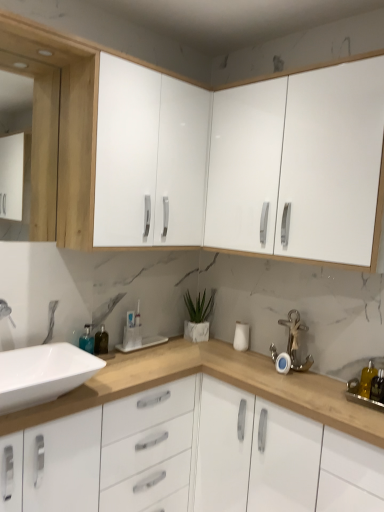
Question: Does white glossy sink at lower left have a smaller size compared to silver metallic anchor at lower right?

Choices:
 (A) yes
 (B) no

Answer: (B)

Question: Does white glossy sink at lower left appear on the right side of silver metallic anchor at lower right?

Choices:
 (A) no
 (B) yes

Answer: (A)

Question: Is white glossy sink at lower left behind silver metallic anchor at lower right?

Choices:
 (A) no
 (B) yes

Answer: (A)

Question: Is white glossy sink at lower left aimed at silver metallic anchor at lower right?

Choices:
 (A) no
 (B) yes

Answer: (A)

Question: From a real-world perspective, is white glossy sink at lower left physically above silver metallic anchor at lower right?

Choices:
 (A) no
 (B) yes

Answer: (A)

Question: Is translucent plastic bottle at lower right in front of or behind matte wood medicine cabinet at left in the image?

Choices:
 (A) behind
 (B) front

Answer: (A)

Question: Do you think translucent plastic bottle at lower right is within matte wood medicine cabinet at left, or outside of it?

Choices:
 (A) outside
 (B) inside

Answer: (A)

Question: From their relative heights in the image, would you say translucent plastic bottle at lower right is taller or shorter than matte wood medicine cabinet at left?

Choices:
 (A) tall
 (B) short

Answer: (B)

Question: From a real-world perspective, relative to matte wood medicine cabinet at left, is translucent plastic bottle at lower right vertically above or below?

Choices:
 (A) above
 (B) below

Answer: (B)

Question: In terms of size, does yellow translucent soap dispenser at right appear bigger or smaller than white glossy cabinet at center, acting as the third cabinetry starting from the top?

Choices:
 (A) big
 (B) small

Answer: (B)

Question: Is yellow translucent soap dispenser at right inside the boundaries of white glossy cabinet at center, the 1th cabinetry in the bottom-to-top sequence, or outside?

Choices:
 (A) outside
 (B) inside

Answer: (A)

Question: Relative to white glossy cabinet at center, acting as the third cabinetry starting from the top, is yellow translucent soap dispenser at right in front or behind?

Choices:
 (A) front
 (B) behind

Answer: (B)

Question: Is yellow translucent soap dispenser at right to the left or to the right of white glossy cabinet at center, acting as the third cabinetry starting from the top, in the image?

Choices:
 (A) left
 (B) right

Answer: (B)

Question: Looking at their shapes, would you say white glossy cabinet at upper right, positioned as the 2th cabinetry in top-to-bottom order, is wider or thinner than white glossy cabinet at center, the 1th cabinetry in the bottom-to-top sequence?

Choices:
 (A) wide
 (B) thin

Answer: (B)

Question: From the image's perspective, is white glossy cabinet at upper right, the 2th cabinetry positioned from the bottom, located above or below white glossy cabinet at center, acting as the third cabinetry starting from the top?

Choices:
 (A) below
 (B) above

Answer: (B)